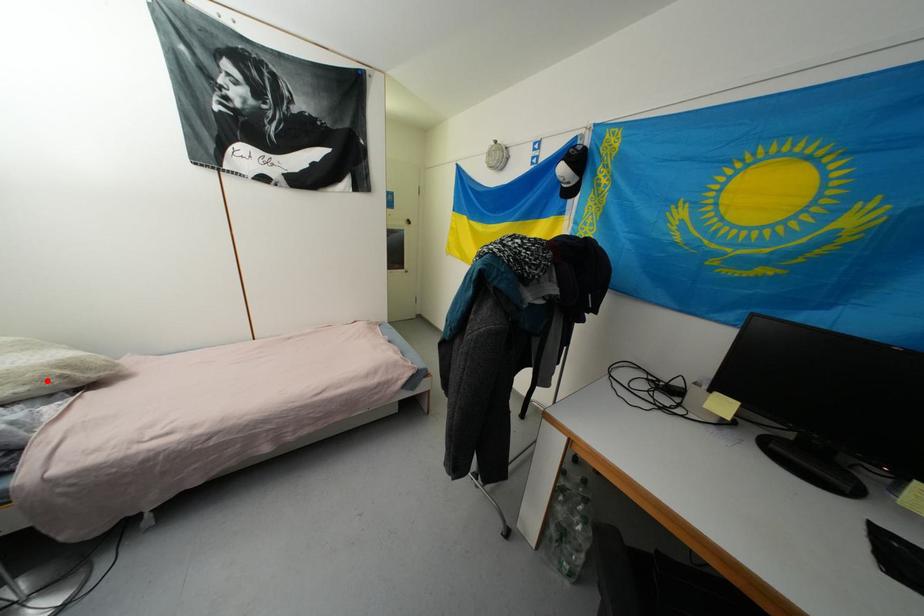
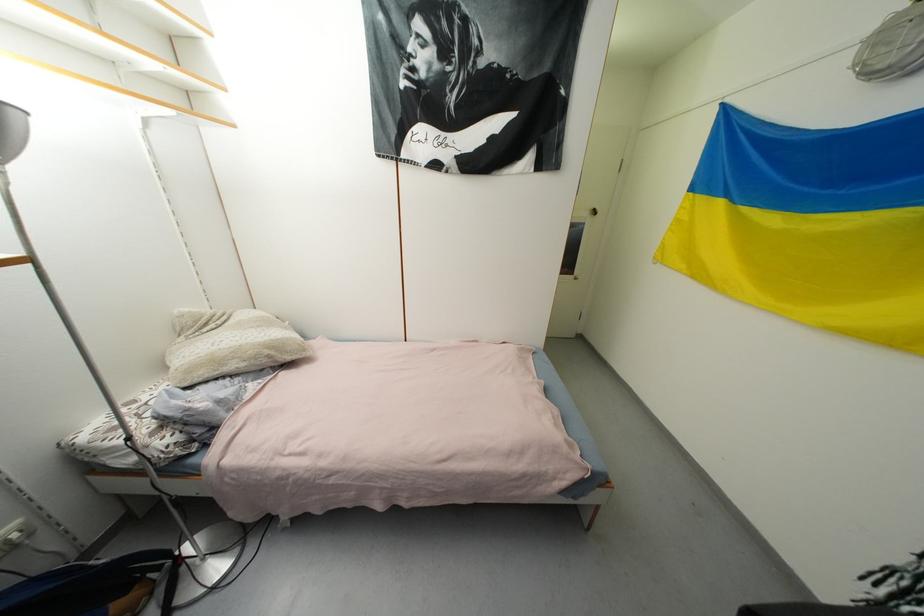
Locate, in the second image, the point that corresponds to the highlighted location in the first image.

(261, 359)